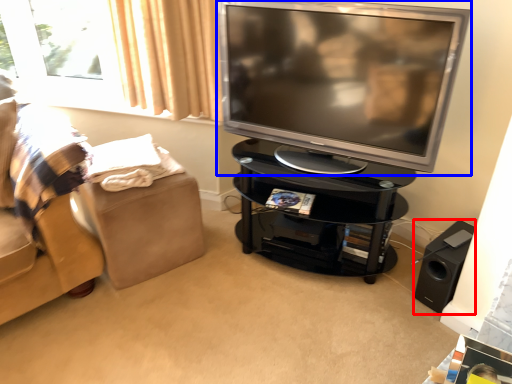
Question: Among these objects, which one is farthest to the camera, speaker (highlighted by a red box) or television (highlighted by a blue box)?

Choices:
 (A) speaker
 (B) television

Answer: (A)